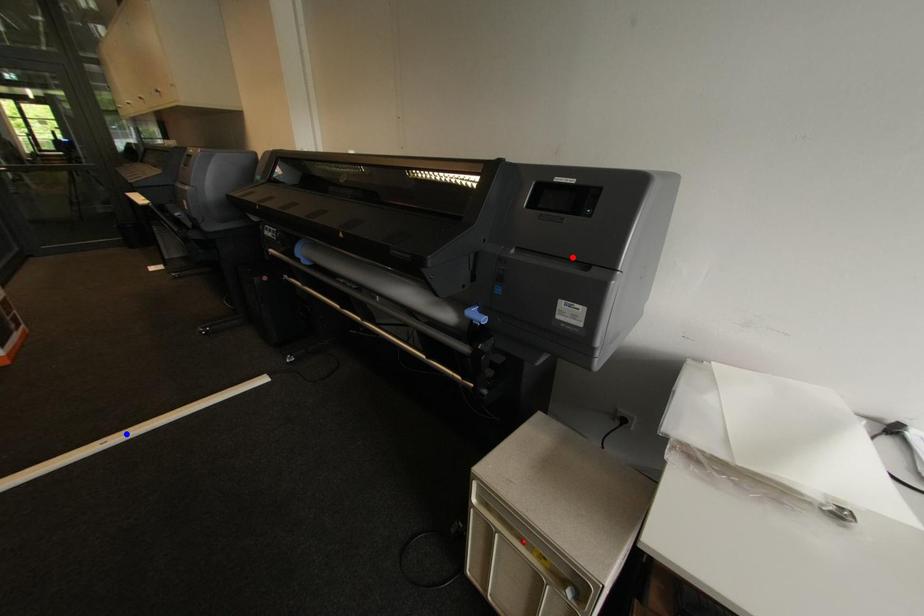
Question: In the image, two points are highlighted. Which point is nearer to the camera? Reply with the corresponding letter.

Choices:
 (A) blue point
 (B) red point

Answer: (B)